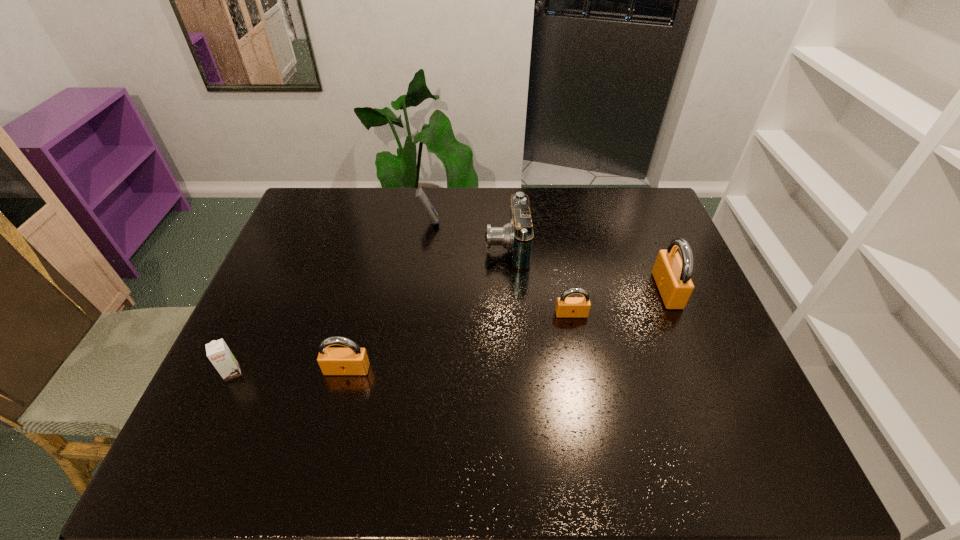
Locate an element on the screen. the second tallest padlock is located at coordinates (353, 360).

Locate an element on the screen. the second object from left to right is located at coordinates (353, 360).

You are a GUI agent. You are given a task and a screenshot of the screen. Output one action in this format:
    pyautogui.click(x=<x>, y=<y>)
    Task: Click on the shortest padlock
    The image size is (960, 540).
    Given the screenshot: What is the action you would take?
    pyautogui.click(x=566, y=307)

Where is `the second padlock from left to right`? The image size is (960, 540). the second padlock from left to right is located at coordinates (566, 307).

Find the location of `the tallest padlock`. the tallest padlock is located at coordinates (672, 275).

Locate an element on the screen. Image resolution: width=960 pixels, height=540 pixels. the tallest object is located at coordinates (672, 275).

Locate an element on the screen. calculator is located at coordinates point(420,195).

This screenshot has height=540, width=960. In order to click on the third object from right to left in this screenshot , I will do `click(516, 236)`.

In order to click on the leftmost object in this screenshot , I will do `click(219, 354)`.

This screenshot has height=540, width=960. I want to click on free space located to unlock the nearest padlock from the front, so click(x=336, y=414).